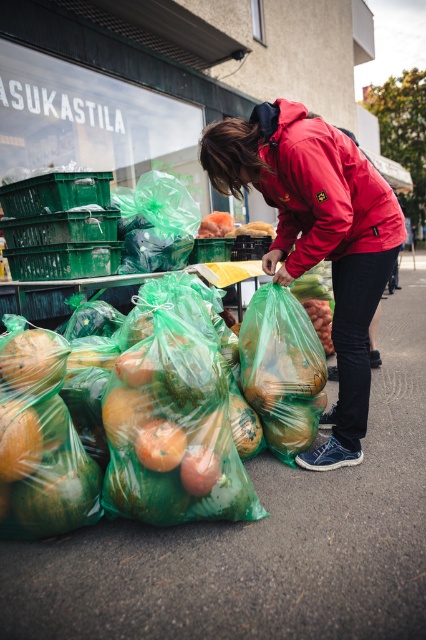
Which is in front, point (400, 241) or point (158, 422)?

Point (158, 422)

Is point (363, 417) positioned after point (166, 461)?

Yes, it is.

Identify the location of matte red jacket at center. (317, 236).

Measure the distance from red matte jacket at center to translucent plastic grocery bag at center.

A distance of 51.66 centimeters exists between red matte jacket at center and translucent plastic grocery bag at center.

Does point (281, 243) come farther from viewer compared to point (287, 292)?

Yes, point (281, 243) is farther from viewer.

Between point (296, 208) and point (276, 438), which one is positioned in front?

Point (296, 208)

This screenshot has width=426, height=640. Identify the location of red matte jacket at center. (322, 189).

Where is `translucent plastic bag of fruits at center`? translucent plastic bag of fruits at center is located at coordinates (112, 426).

Who is taller, translucent plastic bag of fruits at center or orange matte plastic bag at center?

With more height is translucent plastic bag of fruits at center.

Does point (161, 513) lie in front of point (158, 456)?

No, (161, 513) is behind (158, 456).

Identify the location of translucent plastic bag of fruits at center. Image resolution: width=426 pixels, height=640 pixels. (112, 426).